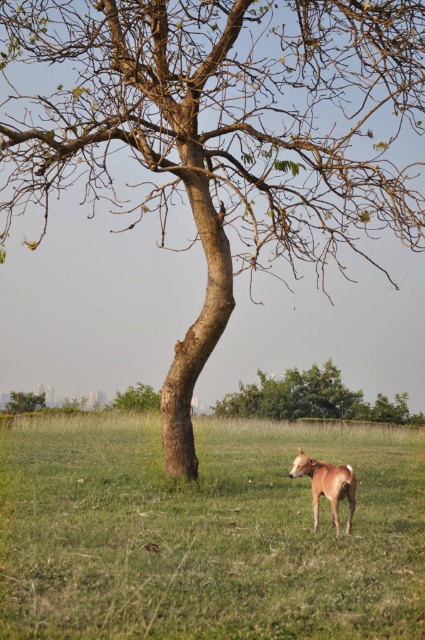
You are an artist planning to paint this scene. You want to ensure that the green leafy tree at center and the green leafy tree at upper left are proportionally accurate. Which tree should you make smaller in your painting?

The green leafy tree at center should be made smaller in the painting because it occupies less space than the green leafy tree at upper left according to the description.

You are a photographer trying to capture the brown fur dog at center and the green leafy tree at center in a single shot. Based on their positions, which one should you focus on first to ensure both are in sharp focus?

The brown fur dog at center is above the green leafy tree at center, so focusing on the dog first will help ensure both are in sharp focus since it is closer to the camera.